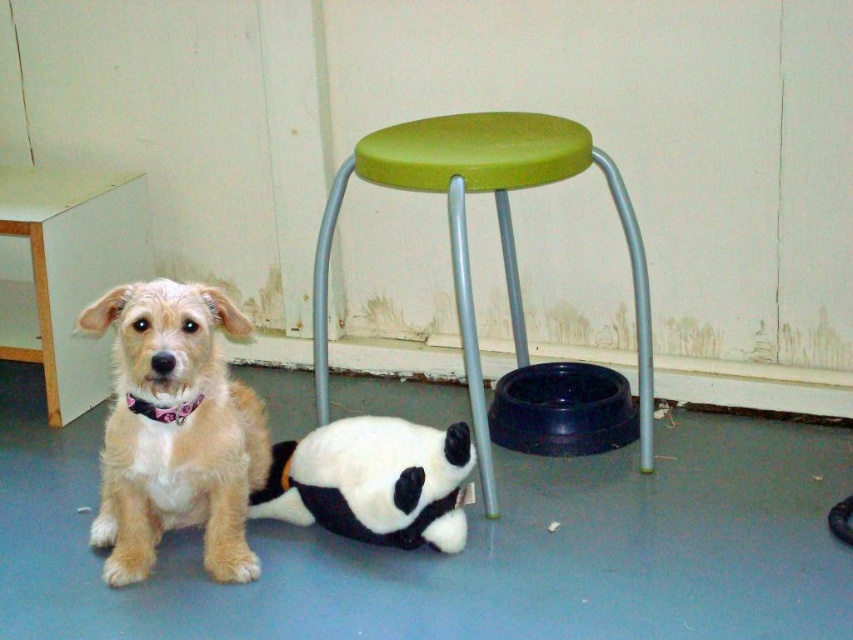
You are a pet owner who wants to place a new toy for your dog. The toy needs to be placed in an area that is not under the green plastic stool at upper center. Where should you place the toy to ensure it is accessible to the fuzzy beige dog at lower left?

The fuzzy beige dog at lower left is positioned under the green plastic stool at upper center. To place the toy where it is not under the stool, you should put it in an area away from the stool, such as next to the dog or in an open space clear of the stool.